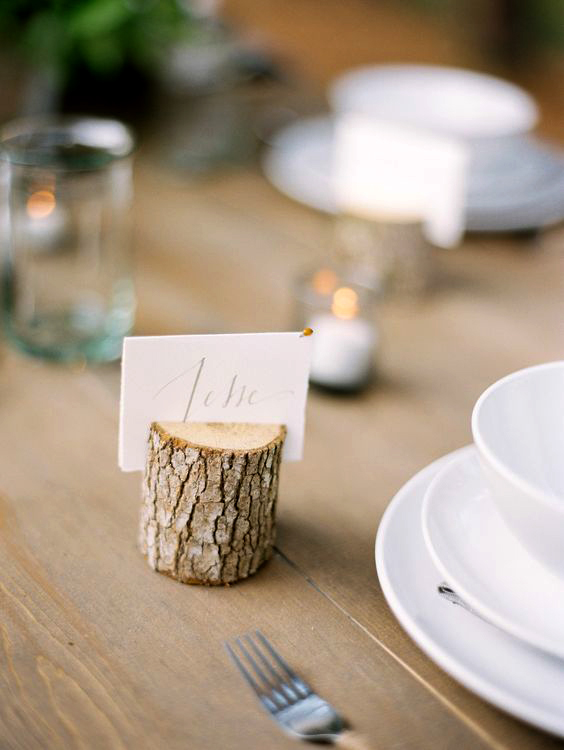
I want to click on bowl, so click(x=537, y=480).